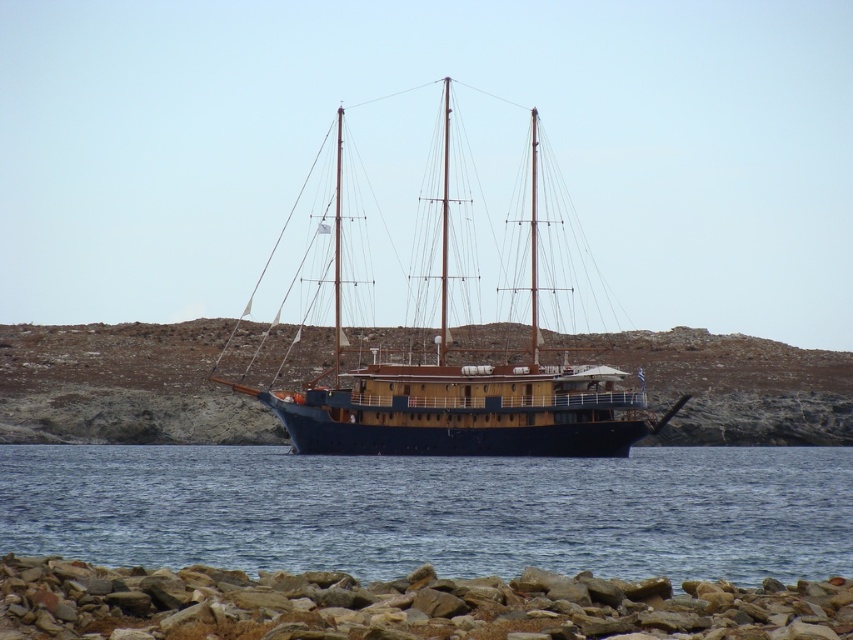
Question: Is blue water at center bigger than rusty stone rocks at lower center?

Choices:
 (A) yes
 (B) no

Answer: (A)

Question: Can you confirm if blue water at center is positioned to the left of blue wooden sailboat at center?

Choices:
 (A) yes
 (B) no

Answer: (B)

Question: Is blue water at center above rusty stone rocks at lower center?

Choices:
 (A) no
 (B) yes

Answer: (B)

Question: Considering the real-world distances, which object is farthest from the blue wooden sailboat at center?

Choices:
 (A) blue water at center
 (B) rusty stone rocks at lower center

Answer: (B)

Question: Which object is closer to the camera taking this photo?

Choices:
 (A) blue wooden sailboat at center
 (B) blue water at center

Answer: (B)

Question: Based on their relative distances, which object is farther from the blue water at center?

Choices:
 (A) blue wooden sailboat at center
 (B) rusty stone rocks at lower center

Answer: (B)